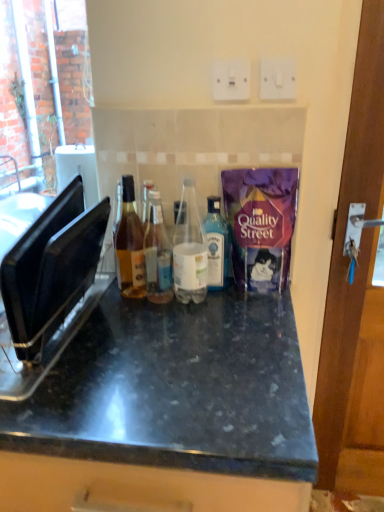
Locate an element on the screen. This screenshot has height=512, width=384. unoccupied region to the right of translucent glass bottle at center, the second bottle in the left-to-right sequence is located at coordinates (245, 308).